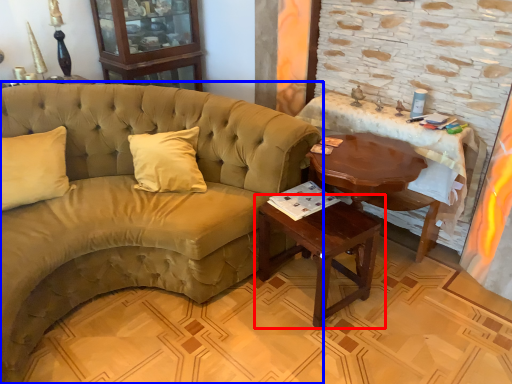
Question: Which object appears closest to the camera in this image, table (highlighted by a red box) or studio couch (highlighted by a blue box)?

Choices:
 (A) table
 (B) studio couch

Answer: (B)